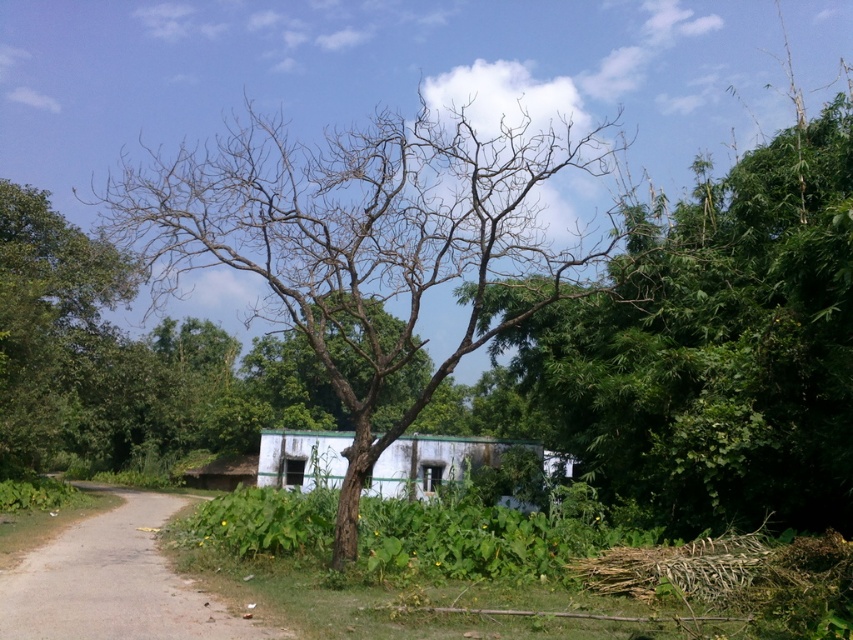
Question: Where is bare branches at left located in relation to white matte/hardobject at center in the image?

Choices:
 (A) below
 (B) above

Answer: (B)

Question: Which point is farther from the camera taking this photo?

Choices:
 (A) (361, 492)
 (B) (90, 300)

Answer: (B)

Question: Based on their relative distances, which object is farther from the white matte/hardobject at center?

Choices:
 (A) bare branches at left
 (B) brown/dry bark tree at center

Answer: (B)

Question: Which of the following is the farthest from the observer?

Choices:
 (A) (329, 442)
 (B) (830, 122)
 (C) (410, 145)

Answer: (A)

Question: Observing the image, what is the correct spatial positioning of bare branches at center in reference to brown/dry bark tree at center?

Choices:
 (A) above
 (B) below

Answer: (B)

Question: Does brown dirt track at lower left have a larger size compared to white matte/hardobject at center?

Choices:
 (A) no
 (B) yes

Answer: (A)